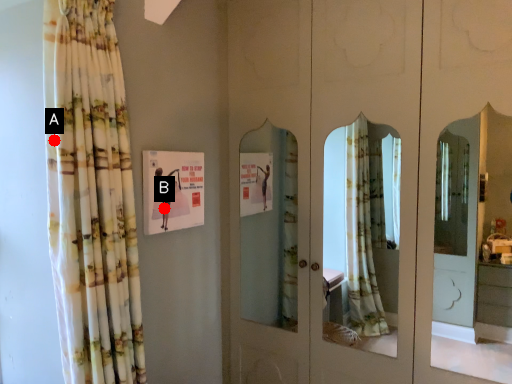
Question: Two points are circled on the image, labeled by A and B beside each circle. Among these points, which one is farthest from the camera?

Choices:
 (A) A is further
 (B) B is further

Answer: (B)